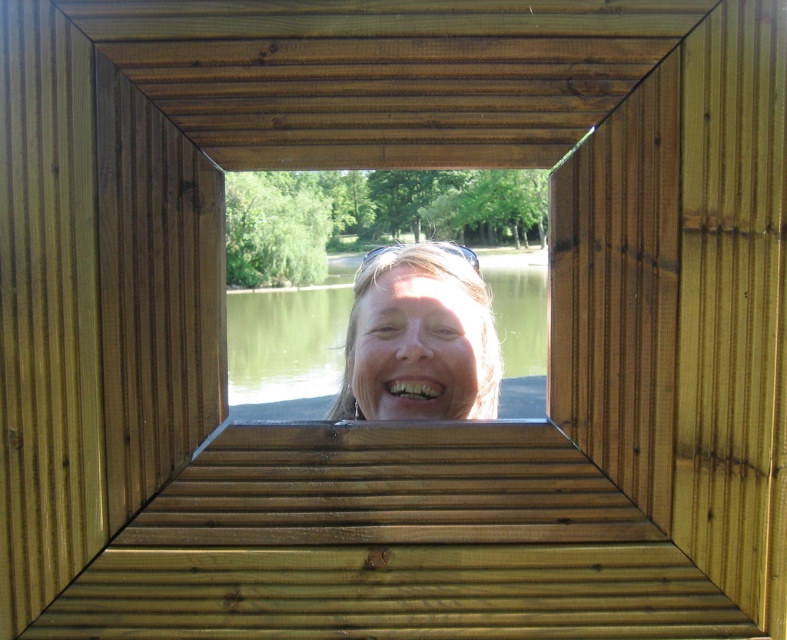
Question: Among these objects, which one is farthest from the camera?

Choices:
 (A) matte skin face at center
 (B) green water at center

Answer: (B)

Question: Is green water at center positioned at the back of matte skin face at center?

Choices:
 (A) yes
 (B) no

Answer: (A)

Question: Can you confirm if green water at center is bigger than matte skin face at center?

Choices:
 (A) yes
 (B) no

Answer: (A)

Question: Can you confirm if green water at center is wider than matte skin face at center?

Choices:
 (A) no
 (B) yes

Answer: (B)

Question: Which point is closer to the camera?

Choices:
 (A) (305, 401)
 (B) (405, 364)

Answer: (B)